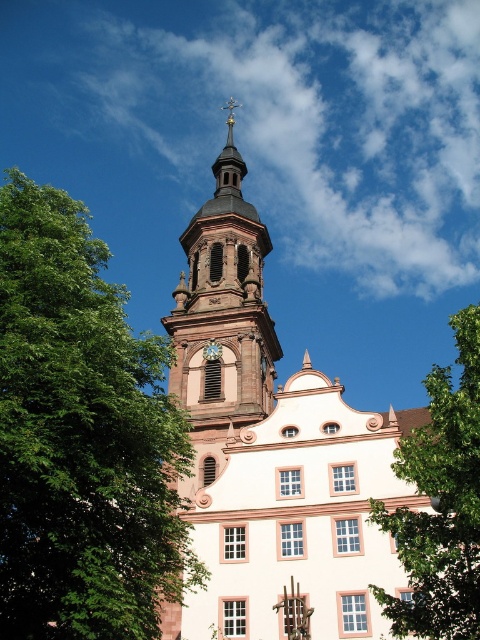
You are standing at the base of the historic building and want to take a photo of the green leafy tree at right. If your camera has a maximum range of 85 feet, will you be able to capture the tree without moving closer?

The green leafy tree at right and camera are 87.63 feet apart, which exceeds the camera maximum range of 85 feet. Therefore, you will not be able to capture the tree without moving closer.